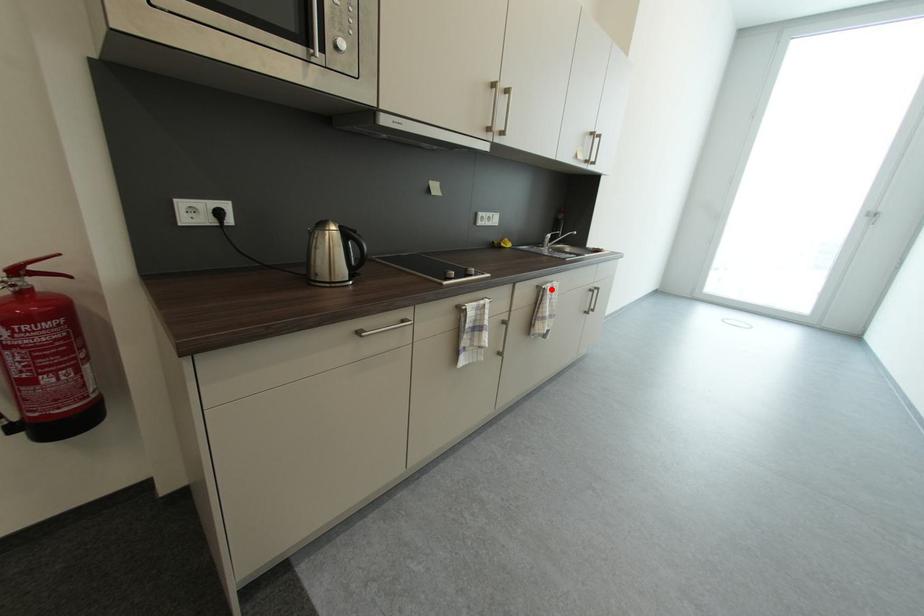
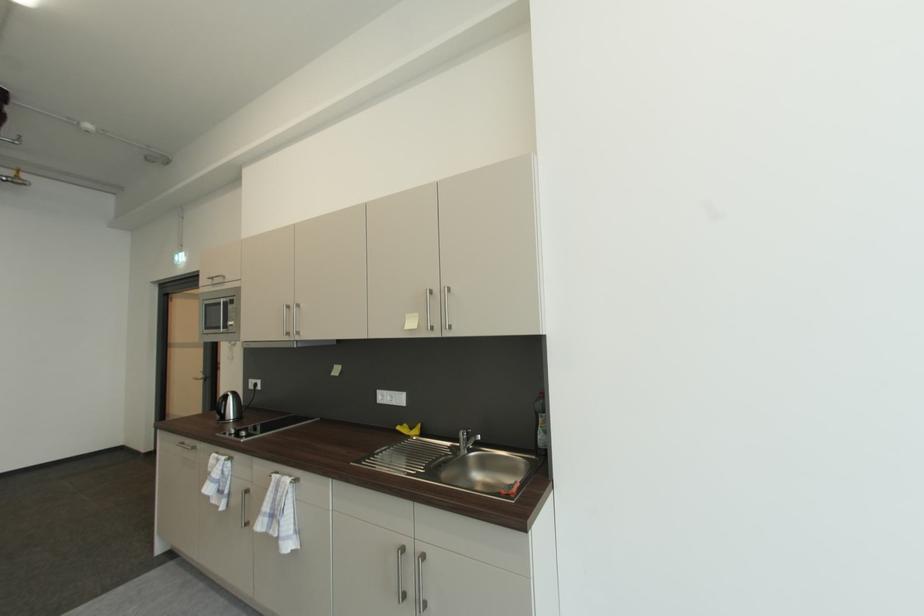
Find the pixel in the second image that matches the highlighted location in the first image.

(277, 477)